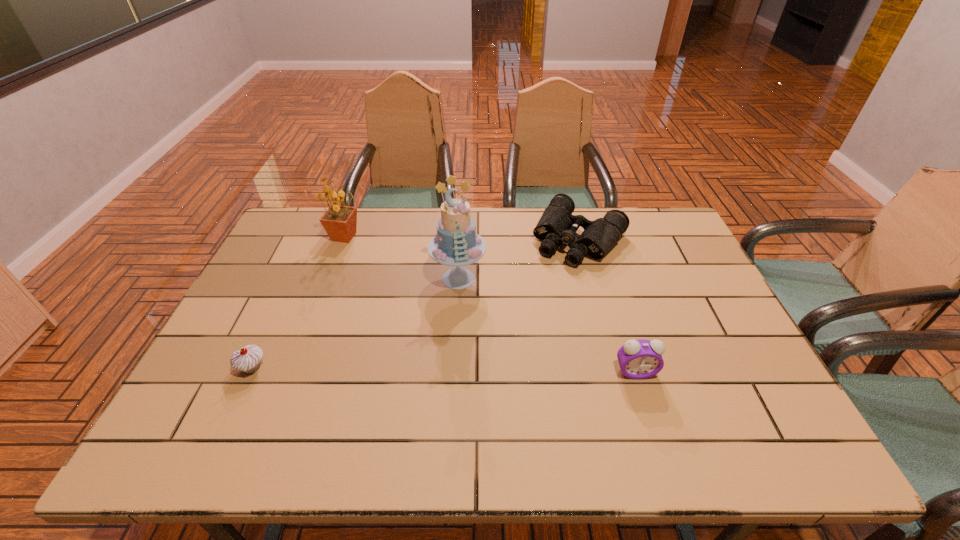
The width and height of the screenshot is (960, 540). I want to click on the leftmost object, so click(x=247, y=359).

At what (x,y) coordinates should I click in order to perform the action: click on alarm clock. Please return your answer as a coordinate pair (x, y). This screenshot has width=960, height=540. Looking at the image, I should click on tap(639, 359).

This screenshot has height=540, width=960. I want to click on the tallest object, so (x=456, y=243).

At what (x,y) coordinates should I click in order to perform the action: click on cake. Please return your answer as a coordinate pair (x, y). Image resolution: width=960 pixels, height=540 pixels. Looking at the image, I should click on (456, 243).

In order to click on the second object from left to right in this screenshot , I will do click(x=339, y=221).

This screenshot has width=960, height=540. I want to click on sunflower, so click(x=339, y=221).

Locate an element on the screen. This screenshot has width=960, height=540. binoculars is located at coordinates (x=557, y=225).

The height and width of the screenshot is (540, 960). Identify the location of vacant space located 0.300m on the back of the cupcake. (295, 276).

The width and height of the screenshot is (960, 540). I want to click on free spot located with a ladder on the side of the tallest object, so click(x=381, y=410).

The height and width of the screenshot is (540, 960). I want to click on free space located with a ladder on the side of the tallest object, so click(399, 379).